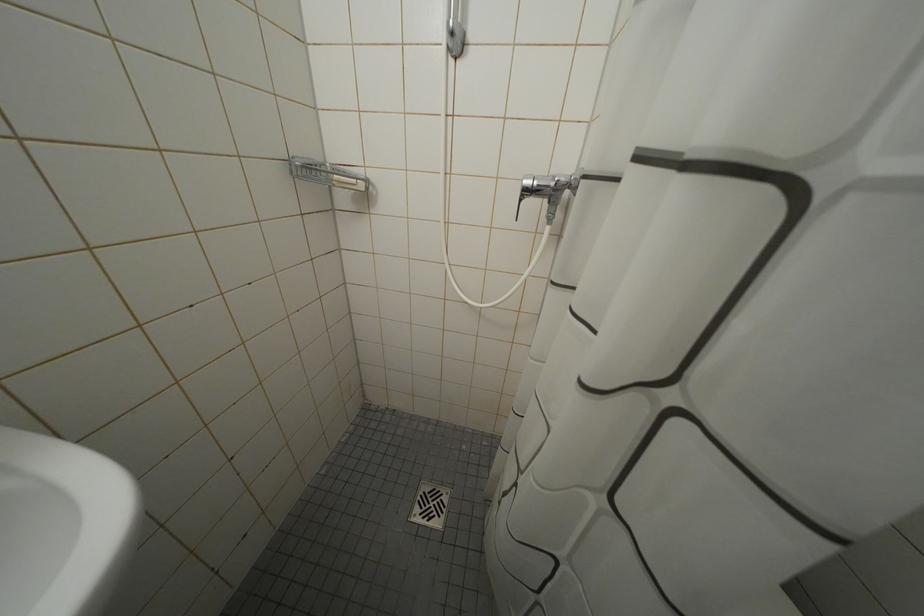
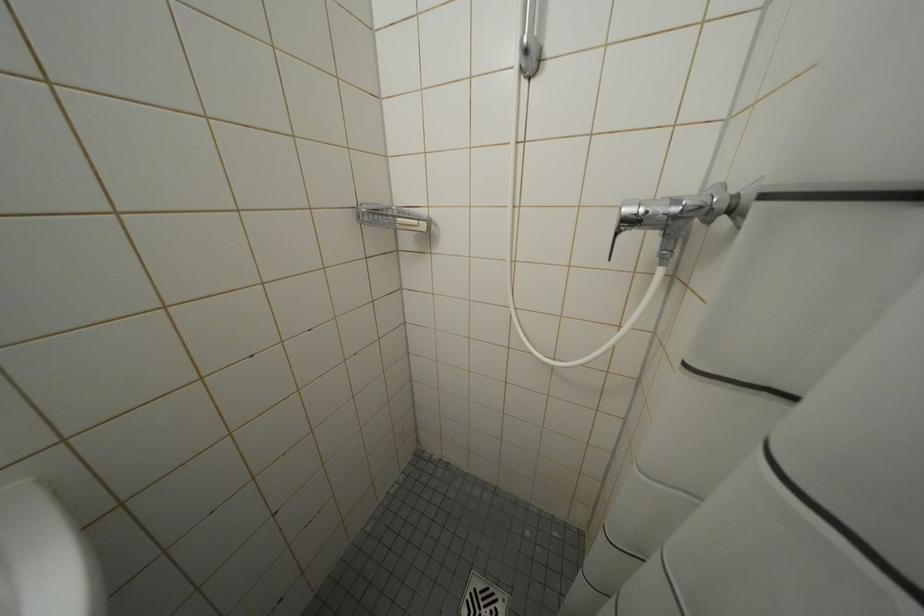
Question: The images are taken continuously from a first-person perspective. In which direction is your viewpoint rotating?

Choices:
 (A) Left
 (B) Right
 (C) Up
 (D) Down

Answer: (A)